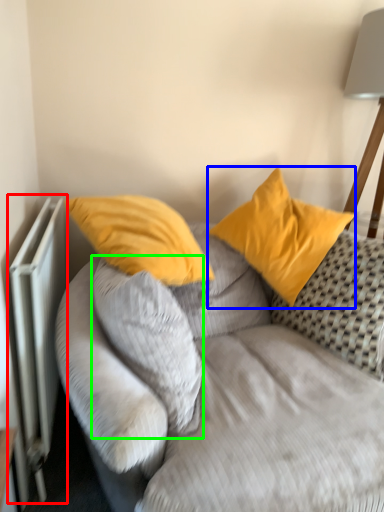
Question: Which object is the farthest from radiator (highlighted by a red box)? Choose among these: pillow (highlighted by a blue box) or pillow (highlighted by a green box).

Choices:
 (A) pillow
 (B) pillow

Answer: (A)